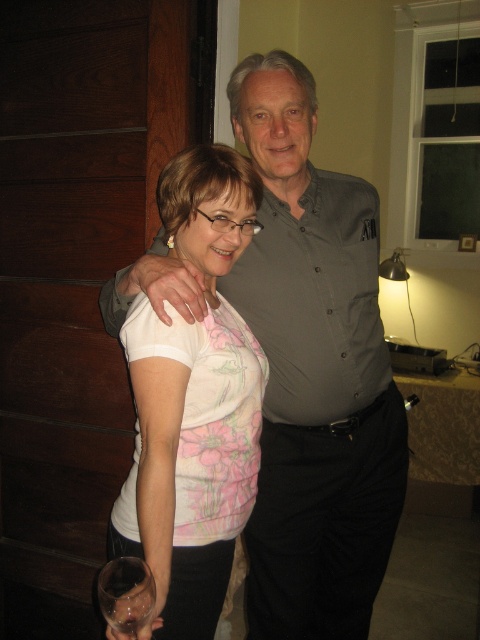
Which is above, white floral shirt at center or transparent glass at lower left?

white floral shirt at center

Is point (183, 416) behind point (113, 618)?

Yes, point (183, 416) is farther from viewer.

Which is behind, point (236, 173) or point (123, 625)?

Point (236, 173)

Locate an element on the screen. white floral shirt at center is located at coordinates (193, 403).

Between gray button-up shirt at center and white floral shirt at center, which one is positioned higher?

gray button-up shirt at center is above.

Who is more forward, [294,504] or [214,253]?

Point [214,253] is in front.

In order to click on gray button-up shirt at center in this screenshot , I will do `click(313, 372)`.

Identify the location of gray button-up shirt at center. (313, 372).

Between gray button-up shirt at center and transparent glass at lower left, which one appears on the left side from the viewer's perspective?

Positioned to the left is transparent glass at lower left.

Can you confirm if gray button-up shirt at center is wider than transparent glass at lower left?

Yes, gray button-up shirt at center is wider than transparent glass at lower left.

Who is more distant from viewer, (375, 433) or (135, 621)?

The point (375, 433) is behind.

You are a GUI agent. You are given a task and a screenshot of the screen. Output one action in this format:
    pyautogui.click(x=<x>, y=<y>)
    Task: Click on the gray button-up shirt at center
    
    Given the screenshot: What is the action you would take?
    pyautogui.click(x=313, y=372)